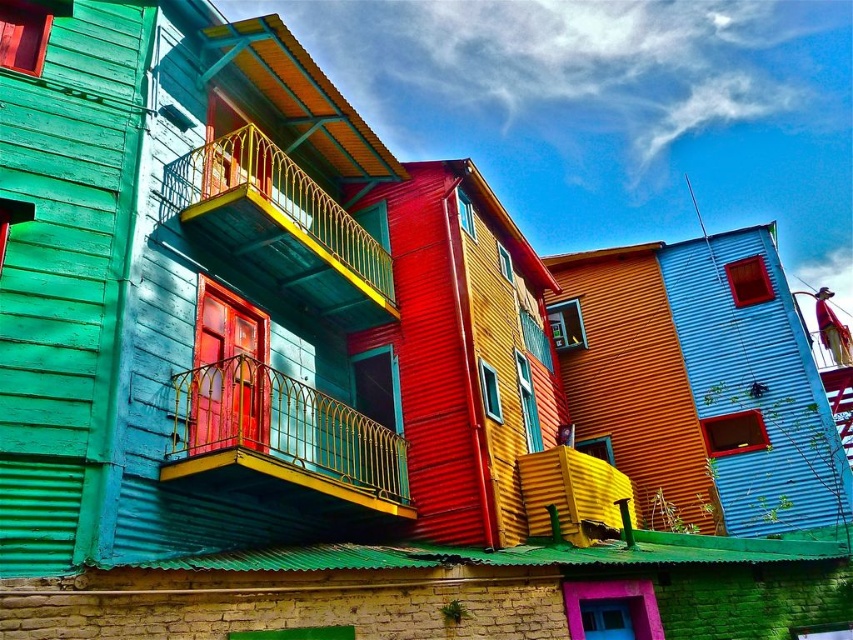
You are a painter who wants to paint the gold wrought iron balcony at center and the yellow metal railing at upper left. Which object requires less paint because of its size?

The gold wrought iron balcony at center requires less paint because it has a smaller size compared to the yellow metal railing at upper left.

You are an architect designing a new housing development and want to ensure that all balconies have sufficient structural support. Given the gold wrought iron balcony at center and the yellow metal railing at upper left, which one might require thicker materials to maintain safety standards?

The yellow metal railing at upper left requires thicker materials because it is thicker than the gold wrought iron balcony at center, which is thinner and may need reinforcement to meet safety standards.